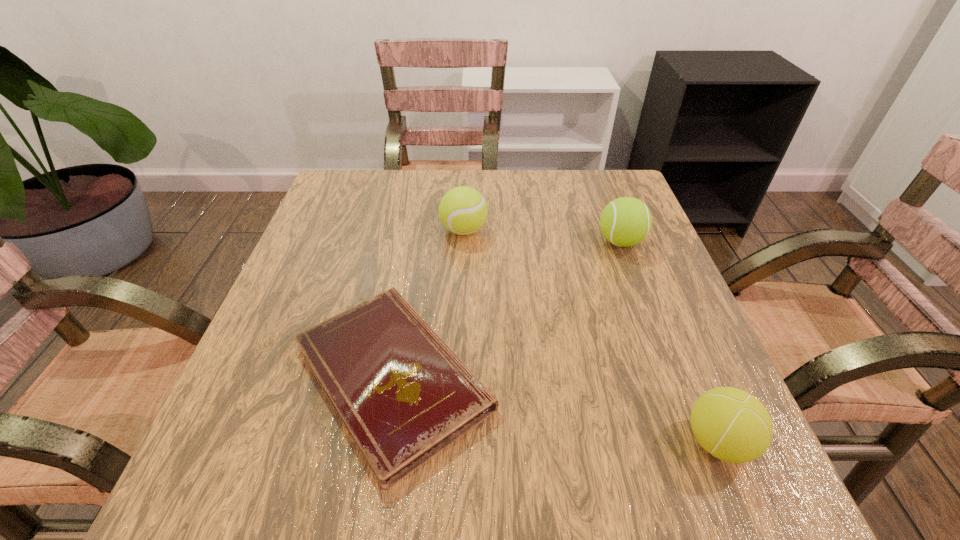
At what (x,y) coordinates should I click in order to perform the action: click on object located in the near left corner section of the desktop. Please return your answer as a coordinate pair (x, y). Looking at the image, I should click on (403, 395).

The height and width of the screenshot is (540, 960). In order to click on object situated at the near right corner in this screenshot , I will do `click(734, 426)`.

You are a GUI agent. You are given a task and a screenshot of the screen. Output one action in this format:
    pyautogui.click(x=<x>, y=<y>)
    Task: Click on the free point at the far edge
    
    Given the screenshot: What is the action you would take?
    pyautogui.click(x=535, y=187)

Locate an element on the screen. This screenshot has height=540, width=960. vacant space at the left edge of the desktop is located at coordinates (298, 437).

The height and width of the screenshot is (540, 960). In the image, there is a desktop. In order to click on vacant space at the right edge in this screenshot , I will do `click(703, 363)`.

Identify the location of vacant space at the far left corner. (343, 212).

In order to click on free space at the far right corner of the desktop in this screenshot , I will do `click(573, 193)`.

Identify the location of free point between the leftmost tennis ball and the shortest object. The height and width of the screenshot is (540, 960). (x=428, y=303).

Locate an element on the screen. The height and width of the screenshot is (540, 960). free spot between the leftmost tennis ball and the shortest object is located at coordinates (428, 303).

Find the location of a particular element. Image resolution: width=960 pixels, height=540 pixels. free space between the shortest object and the nearest tennis ball is located at coordinates (555, 409).